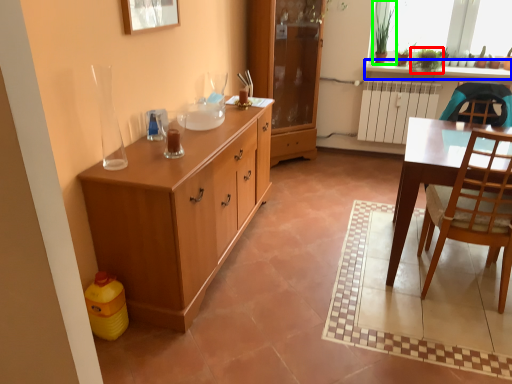
Question: Which object is positioned farthest from houseplant (highlighted by a red box)? Select from counter top (highlighted by a blue box) and houseplant (highlighted by a green box).

Choices:
 (A) counter top
 (B) houseplant

Answer: (B)